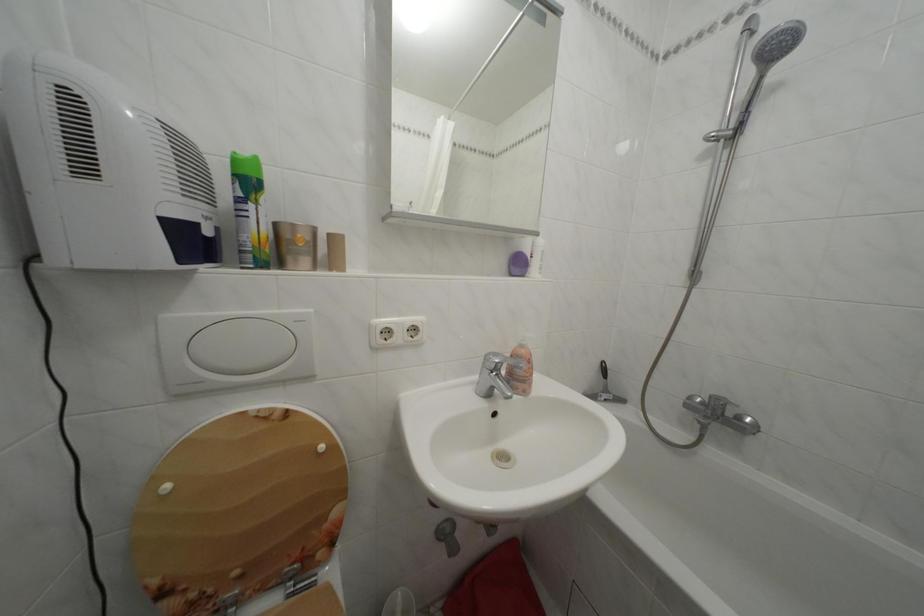
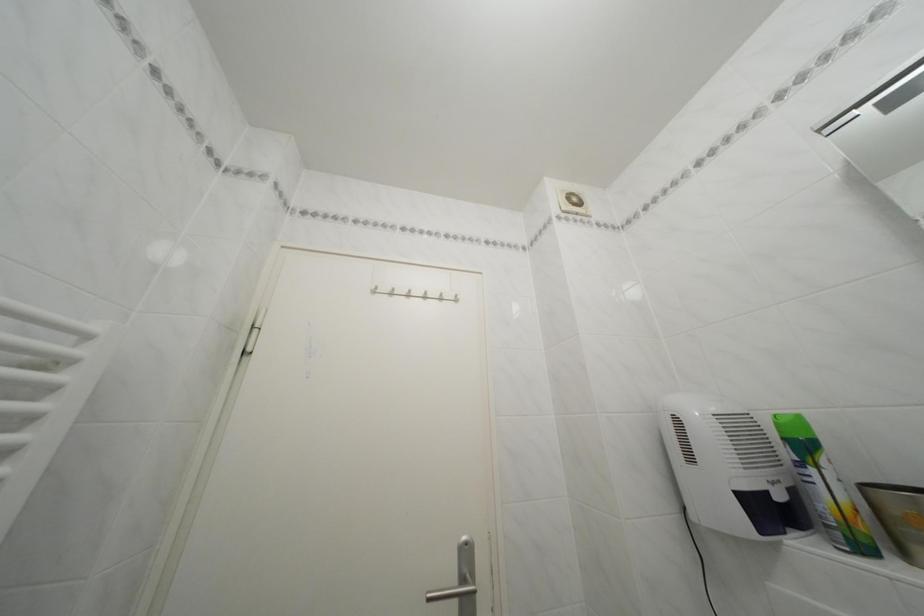
In the second image, find the point that corresponds to point 290,272 in the first image.

(915, 561)